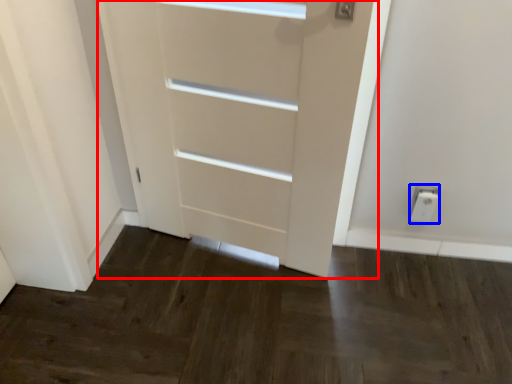
Question: Among these objects, which one is farthest to the camera, door (highlighted by a red box) or electric outlet (highlighted by a blue box)?

Choices:
 (A) door
 (B) electric outlet

Answer: (B)